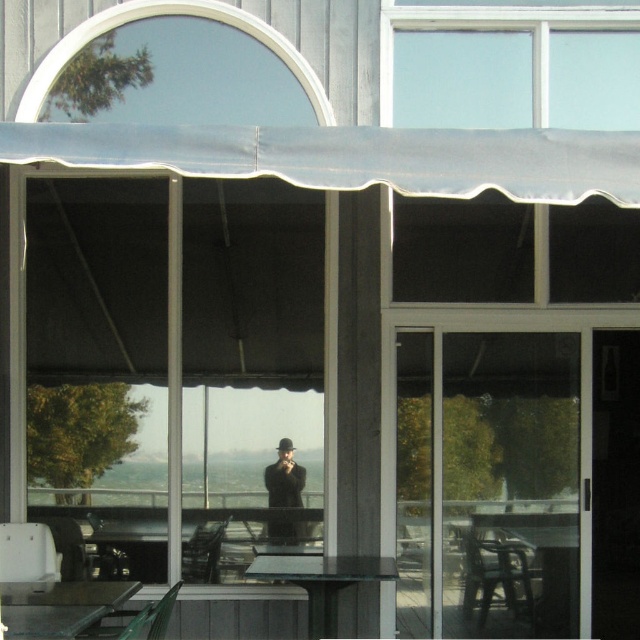
Question: Which object appears farthest from the camera in this image?

Choices:
 (A) transparent glass door at center
 (B) white fabric awning at upper center
 (C) metallic silver table at lower left
 (D) black matte coat at center

Answer: (D)

Question: Does white fabric awning at upper center have a smaller size compared to black matte coat at center?

Choices:
 (A) yes
 (B) no

Answer: (B)

Question: Is metallic silver table at lower left thinner than black matte coat at center?

Choices:
 (A) yes
 (B) no

Answer: (B)

Question: Based on their relative distances, which object is farther from the white fabric awning at upper center?

Choices:
 (A) transparent glass door at center
 (B) metallic silver table at lower left

Answer: (A)

Question: Can you confirm if transparent glass door at center is positioned above black matte coat at center?

Choices:
 (A) no
 (B) yes

Answer: (B)

Question: Which object appears farthest from the camera in this image?

Choices:
 (A) transparent glass table at center
 (B) transparent glass door at center

Answer: (B)